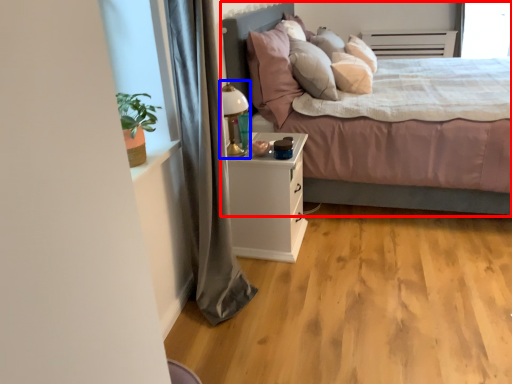
Question: Which object is closer to the camera taking this photo, bed (highlighted by a red box) or table lamp (highlighted by a blue box)?

Choices:
 (A) bed
 (B) table lamp

Answer: (A)